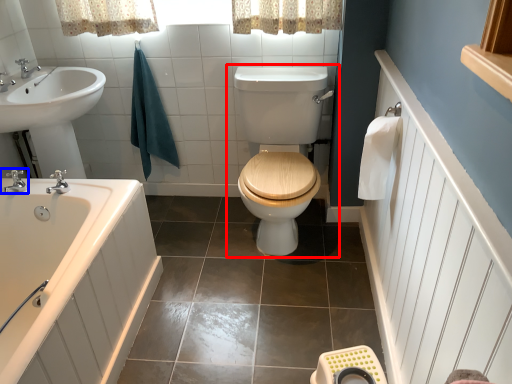
Question: Which of the following is the farthest to the observer, toilet (highlighted by a red box) or tap (highlighted by a blue box)?

Choices:
 (A) toilet
 (B) tap

Answer: (B)